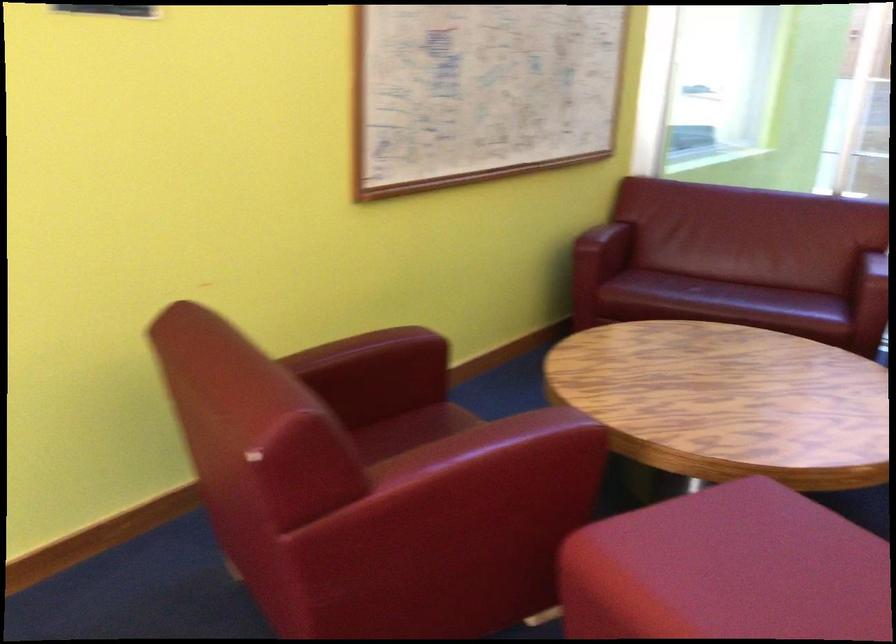
Where is `chair sitting surface`? The image size is (896, 644). chair sitting surface is located at coordinates (410, 428).